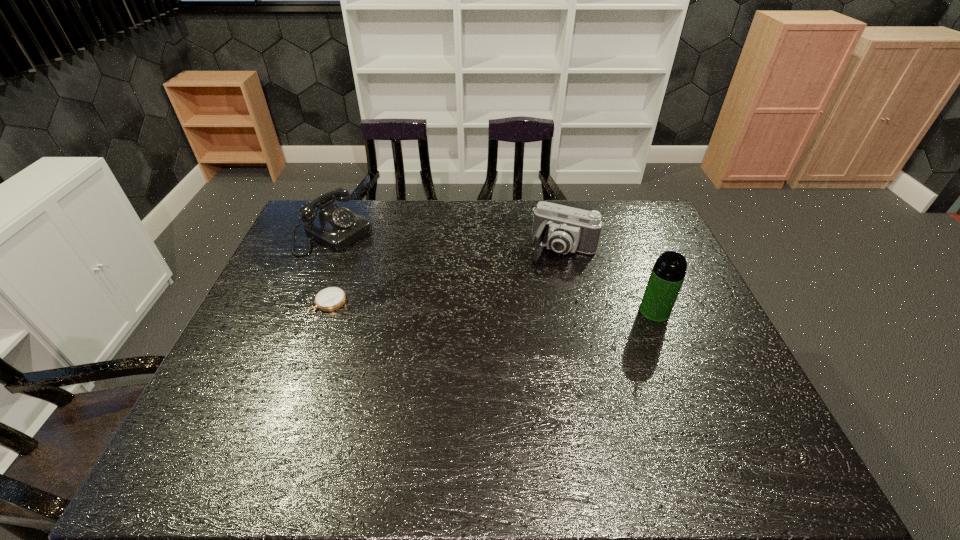
Find the location of a particular element. This screenshot has height=540, width=960. vacant space located 0.080m on the dial of the telephone is located at coordinates (376, 258).

Where is `free location located 0.180m on the dial of the telephone`? This screenshot has height=540, width=960. free location located 0.180m on the dial of the telephone is located at coordinates (398, 270).

The image size is (960, 540). I want to click on free location located on the dial of the telephone, so click(x=398, y=270).

Where is `camera located at the far edge`? The width and height of the screenshot is (960, 540). camera located at the far edge is located at coordinates [563, 229].

This screenshot has height=540, width=960. Find the location of `telephone that is at the far edge`. telephone that is at the far edge is located at coordinates (335, 227).

In order to click on compass at the left edge in this screenshot , I will do click(x=329, y=299).

Locate an element on the screen. Image resolution: width=960 pixels, height=540 pixels. telephone located in the left edge section of the desktop is located at coordinates (335, 227).

Find the location of a particular element. The width and height of the screenshot is (960, 540). object that is positioned at the right edge is located at coordinates (668, 273).

This screenshot has height=540, width=960. I want to click on object located at the far left corner, so click(x=335, y=227).

Where is `vacant region at the far edge`? vacant region at the far edge is located at coordinates (594, 210).